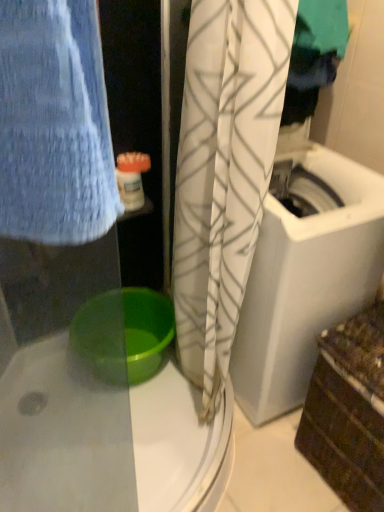
Question: In terms of size, does white textured curtain at center appear bigger or smaller than green plastic basin at lower center?

Choices:
 (A) big
 (B) small

Answer: (A)

Question: In terms of height, does white textured curtain at center look taller or shorter compared to green plastic basin at lower center?

Choices:
 (A) tall
 (B) short

Answer: (A)

Question: Which object is the farthest from the green plastic basin at lower center?

Choices:
 (A) white plastic container at upper center
 (B) white textured curtain at center

Answer: (A)

Question: Based on their relative distances, which object is farther from the white plastic container at upper center?

Choices:
 (A) green plastic basin at lower center
 (B) white textured curtain at center

Answer: (A)